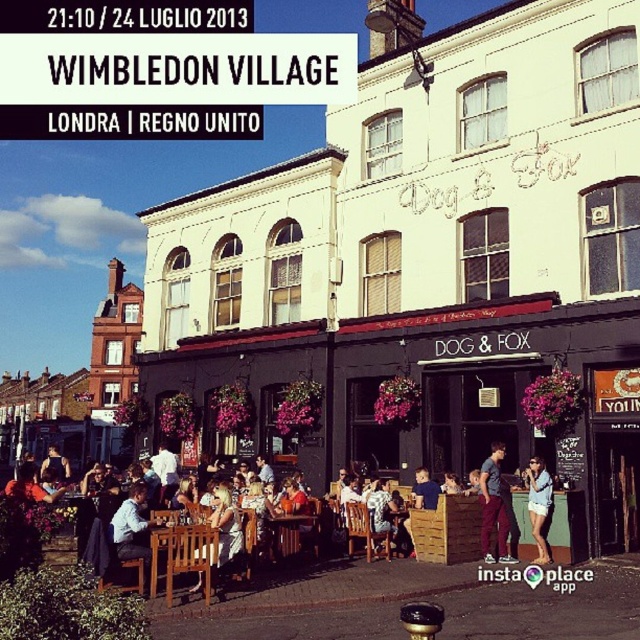
Question: Which point is closer to the camera?

Choices:
 (A) (156, 547)
 (B) (509, 560)
 (C) (60, 458)
 (D) (449, 490)

Answer: (A)

Question: Is silvery metallic dress at center to the left of matte black jacket at center from the viewer's perspective?

Choices:
 (A) yes
 (B) no

Answer: (A)

Question: Can you confirm if silvery metallic dress at center is positioned above denim shorts at center?

Choices:
 (A) no
 (B) yes

Answer: (A)

Question: Which is nearer to the brown wooden table at center?

Choices:
 (A) silvery metallic dress at center
 (B) wooden chair at lower center
 (C) matte purple pants at lower right
 (D) wooden table at center

Answer: (A)

Question: In this image, where is wooden chair at lower center located relative to silvery metallic dress at center?

Choices:
 (A) right
 (B) left

Answer: (B)

Question: Which point is closer to the camera?

Choices:
 (A) matte blue shirt at center
 (B) wooden chair at lower center
 (C) silvery metallic dress at center

Answer: (B)